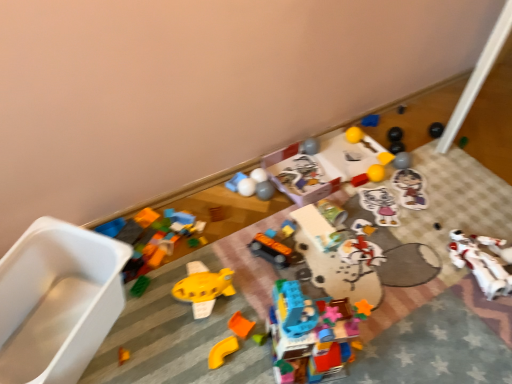
You are a GUI agent. You are given a task and a screenshot of the screen. Output one action in this format:
    pyautogui.click(x=<x>, y=<y>)
    Task: Click on the free area in between yellow rubber ball at upper center, the 3th toy in the right-to-left sequence, and translucent plastic building blocks at center, which ranks as the ninth toy in right-to-left order
    This screenshot has width=512, height=384.
    Given the screenshot: What is the action you would take?
    pyautogui.click(x=351, y=243)